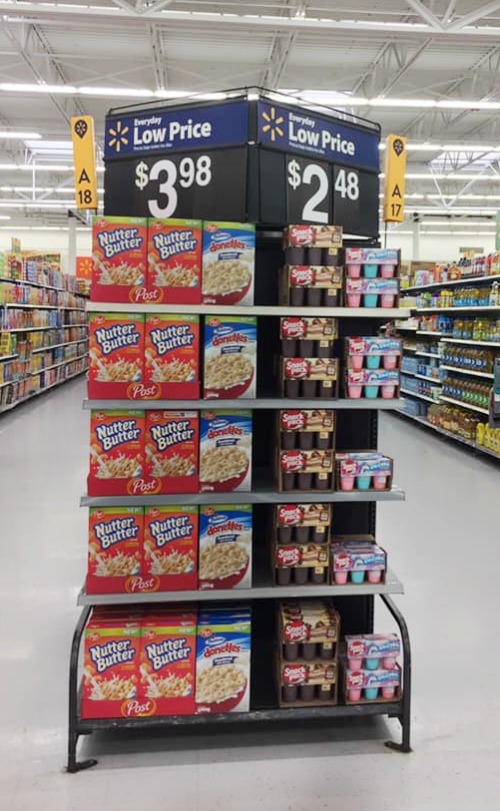
Where is `shelves`? shelves is located at coordinates (389, 311), (381, 404), (388, 500), (379, 588), (380, 710).